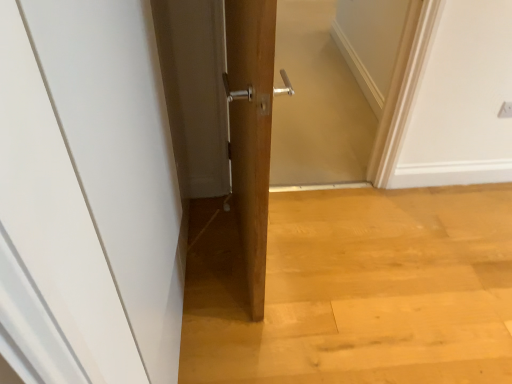
Question: Is wooden screen door at center facing towards white plastic electric outlet at upper right?

Choices:
 (A) no
 (B) yes

Answer: (A)

Question: Is wooden screen door at center completely or partially outside of white plastic electric outlet at upper right?

Choices:
 (A) yes
 (B) no

Answer: (A)

Question: From the image's perspective, is wooden screen door at center beneath white plastic electric outlet at upper right?

Choices:
 (A) yes
 (B) no

Answer: (B)

Question: Is wooden screen door at center bigger than white plastic electric outlet at upper right?

Choices:
 (A) no
 (B) yes

Answer: (B)

Question: Can you confirm if wooden screen door at center is taller than white plastic electric outlet at upper right?

Choices:
 (A) yes
 (B) no

Answer: (A)

Question: Does point (507, 102) appear closer or farther from the camera than point (120, 142)?

Choices:
 (A) closer
 (B) farther

Answer: (B)

Question: From a real-world perspective, is white plastic electric outlet at upper right above or below white matte door at center?

Choices:
 (A) below
 (B) above

Answer: (A)

Question: Considering the positions of white plastic electric outlet at upper right and white matte door at center in the image, is white plastic electric outlet at upper right wider or thinner than white matte door at center?

Choices:
 (A) thin
 (B) wide

Answer: (A)

Question: From their relative heights in the image, would you say white plastic electric outlet at upper right is taller or shorter than white matte door at center?

Choices:
 (A) short
 (B) tall

Answer: (A)

Question: From the image's perspective, relative to wooden screen door at center, is white matte door at center above or below?

Choices:
 (A) below
 (B) above

Answer: (A)

Question: Considering the positions of white matte door at center and wooden screen door at center in the image, is white matte door at center taller or shorter than wooden screen door at center?

Choices:
 (A) tall
 (B) short

Answer: (A)

Question: Is point (152, 96) positioned closer to the camera than point (279, 105)?

Choices:
 (A) farther
 (B) closer

Answer: (B)

Question: Relative to wooden screen door at center, is white matte door at center in front or behind?

Choices:
 (A) front
 (B) behind

Answer: (A)

Question: Is white matte door at center taller or shorter than white plastic electric outlet at upper right?

Choices:
 (A) short
 (B) tall

Answer: (B)

Question: Looking at their shapes, would you say white matte door at center is wider or thinner than white plastic electric outlet at upper right?

Choices:
 (A) thin
 (B) wide

Answer: (B)